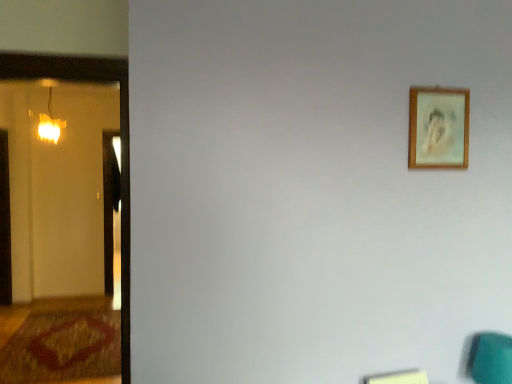
Question: Can you confirm if matte glass lamp at left is shorter than teal fabric swivel chair at lower right?

Choices:
 (A) yes
 (B) no

Answer: (B)

Question: Can you confirm if matte glass lamp at left is thinner than teal fabric swivel chair at lower right?

Choices:
 (A) no
 (B) yes

Answer: (A)

Question: Considering the relative positions of matte glass lamp at left and teal fabric swivel chair at lower right in the image provided, is matte glass lamp at left to the right of teal fabric swivel chair at lower right from the viewer's perspective?

Choices:
 (A) no
 (B) yes

Answer: (A)

Question: From a real-world perspective, is matte glass lamp at left physically above teal fabric swivel chair at lower right?

Choices:
 (A) no
 (B) yes

Answer: (B)

Question: Is matte glass lamp at left with teal fabric swivel chair at lower right?

Choices:
 (A) no
 (B) yes

Answer: (A)

Question: Is point (102, 377) positioned closer to the camera than point (51, 96)?

Choices:
 (A) closer
 (B) farther

Answer: (A)

Question: Considering the relative positions of brown textured rug at lower left and matte glass lamp at left in the image provided, is brown textured rug at lower left to the left or to the right of matte glass lamp at left?

Choices:
 (A) left
 (B) right

Answer: (A)

Question: From the image's perspective, relative to matte glass lamp at left, is brown textured rug at lower left above or below?

Choices:
 (A) above
 (B) below

Answer: (B)

Question: From a real-world perspective, is brown textured rug at lower left positioned above or below matte glass lamp at left?

Choices:
 (A) above
 (B) below

Answer: (B)

Question: Is brown textured rug at lower left in front of or behind teal fabric swivel chair at lower right in the image?

Choices:
 (A) front
 (B) behind

Answer: (B)

Question: Considering the positions of brown textured rug at lower left and teal fabric swivel chair at lower right in the image, is brown textured rug at lower left wider or thinner than teal fabric swivel chair at lower right?

Choices:
 (A) thin
 (B) wide

Answer: (B)

Question: In the image, is brown textured rug at lower left on the left side or the right side of teal fabric swivel chair at lower right?

Choices:
 (A) right
 (B) left

Answer: (B)

Question: Considering the positions of brown textured rug at lower left and teal fabric swivel chair at lower right in the image, is brown textured rug at lower left bigger or smaller than teal fabric swivel chair at lower right?

Choices:
 (A) big
 (B) small

Answer: (A)

Question: From a real-world perspective, is wooden picture frame at upper right positioned above or below teal fabric swivel chair at lower right?

Choices:
 (A) below
 (B) above

Answer: (B)

Question: Would you say wooden picture frame at upper right is to the left or to the right of teal fabric swivel chair at lower right in the picture?

Choices:
 (A) right
 (B) left

Answer: (B)